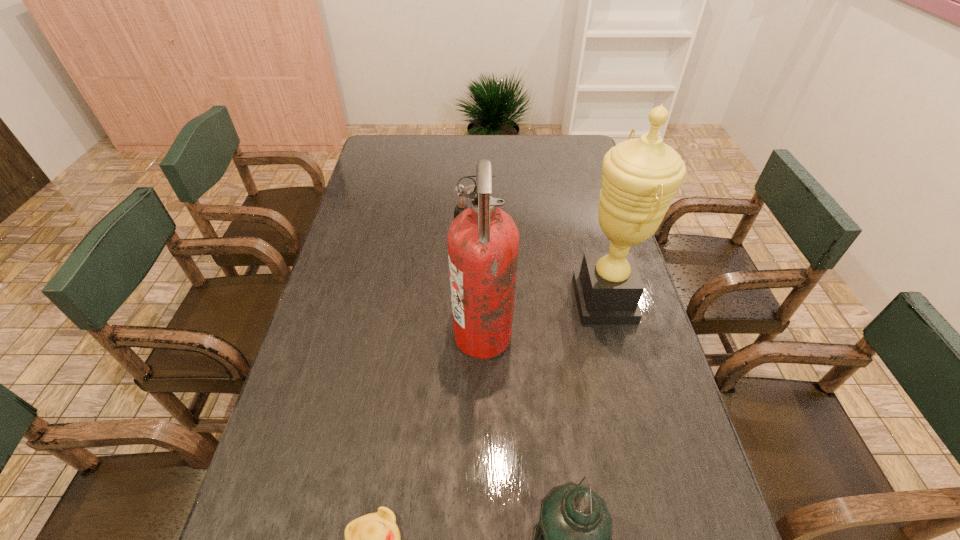
Where is `vacant space at the left edge`? Image resolution: width=960 pixels, height=540 pixels. vacant space at the left edge is located at coordinates (365, 184).

Where is `free region at the right edge`? free region at the right edge is located at coordinates (584, 181).

This screenshot has height=540, width=960. In the image, there is a desktop. Identify the location of vacant area at the far left corner. (402, 147).

This screenshot has width=960, height=540. Identify the location of vacant space at the far right corner of the desktop. (553, 158).

Point out which object is positioned as the third nearest to the fire extinguisher. Please provide its 2D coordinates. Your answer should be formatted as a tuple, i.e. [(x, y)], where the tuple contains the x and y coordinates of a point satisfying the conditions above.

[(374, 539)]

Locate which object ranks third in proximity to the leftmost object. Please provide its 2D coordinates. Your answer should be formatted as a tuple, i.e. [(x, y)], where the tuple contains the x and y coordinates of a point satisfying the conditions above.

[(640, 177)]